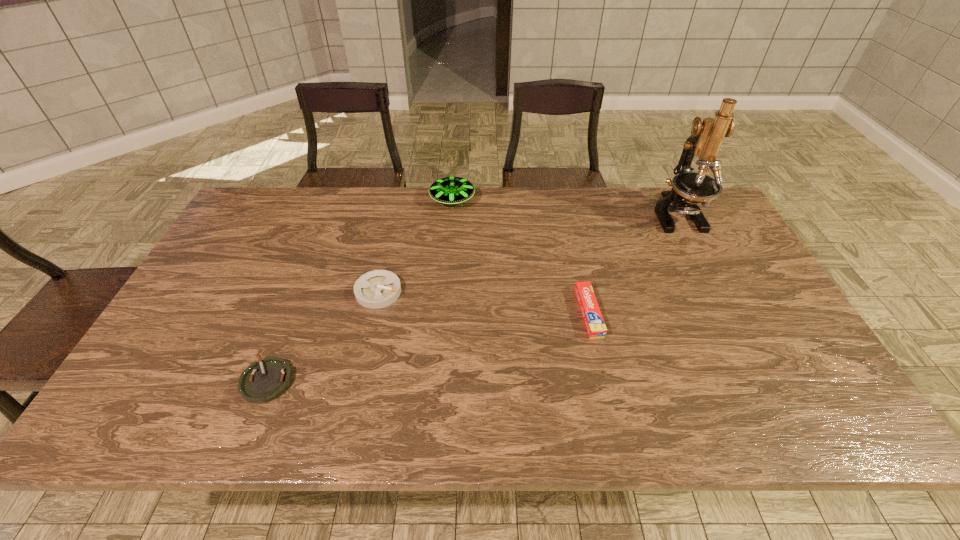
Find the location of `the rightmost object`. the rightmost object is located at coordinates (689, 188).

The image size is (960, 540). Find the location of `microscope`. microscope is located at coordinates (689, 188).

Identify the location of the second tallest object. The image size is (960, 540). (449, 190).

The height and width of the screenshot is (540, 960). In order to click on the third object from left to right in this screenshot , I will do `click(449, 190)`.

Locate an element on the screen. This screenshot has height=540, width=960. the taller ashtray is located at coordinates (376, 289).

I want to click on the farther ashtray, so click(x=376, y=289).

Find the location of a particular element. The width and height of the screenshot is (960, 540). the second object from right to left is located at coordinates (595, 325).

Identify the location of the nearest object. (263, 381).

At what (x,y) coordinates should I click in order to perform the action: click on the leftmost object. Please return your answer as a coordinate pair (x, y). The height and width of the screenshot is (540, 960). Looking at the image, I should click on (263, 381).

Where is `vacant region located at the eyepiece of the rightmost object`? The height and width of the screenshot is (540, 960). vacant region located at the eyepiece of the rightmost object is located at coordinates click(x=730, y=316).